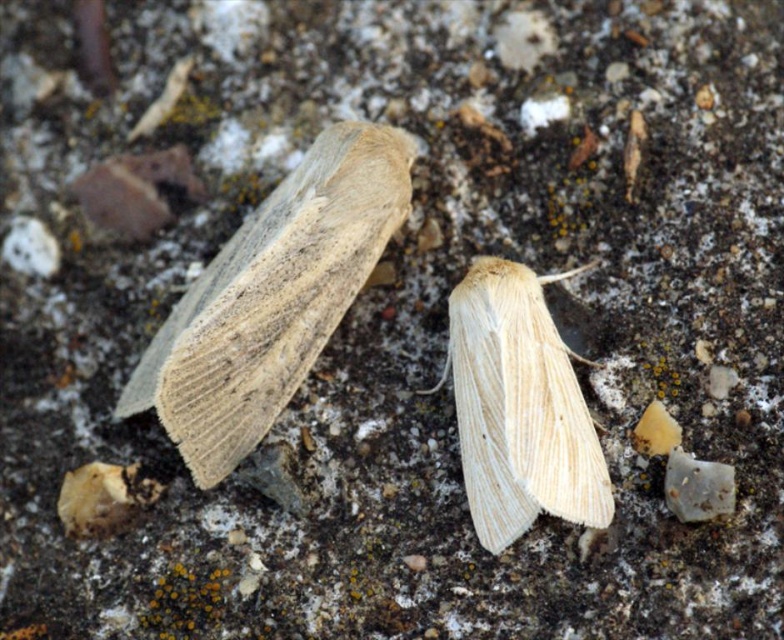
Question: Among these points, which one is nearest to the camera?

Choices:
 (A) (521, 355)
 (B) (252, 294)

Answer: (B)

Question: Can you confirm if beige woolen moth at upper left is positioned to the left of light beige wool moth at center?

Choices:
 (A) no
 (B) yes

Answer: (B)

Question: Which point is farther to the camera?

Choices:
 (A) beige woolen moth at upper left
 (B) light beige wool moth at center

Answer: (B)

Question: Does beige woolen moth at upper left appear on the left side of light beige wool moth at center?

Choices:
 (A) no
 (B) yes

Answer: (B)

Question: Considering the relative positions of beige woolen moth at upper left and light beige wool moth at center in the image provided, where is beige woolen moth at upper left located with respect to light beige wool moth at center?

Choices:
 (A) above
 (B) below

Answer: (A)